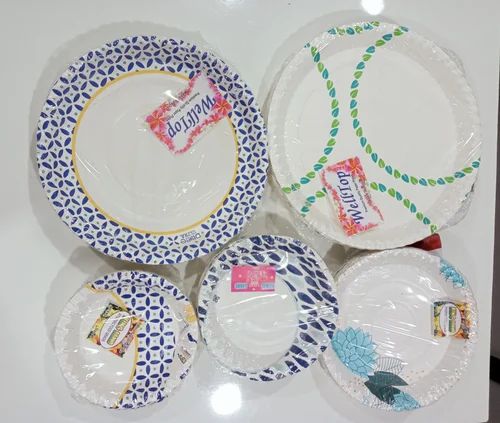
Find the location of a particular element. plates is located at coordinates (366, 152), (142, 158), (108, 330), (225, 317), (397, 323).